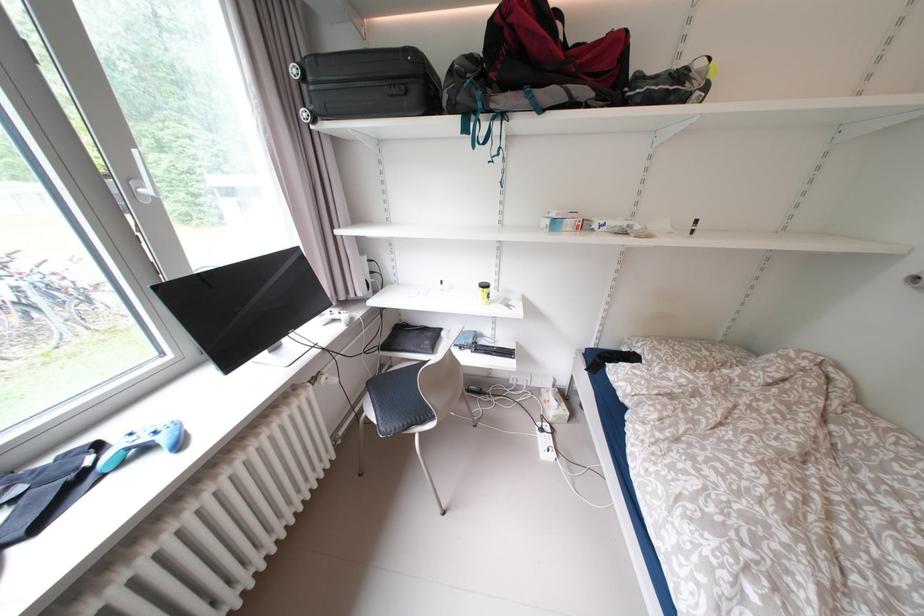
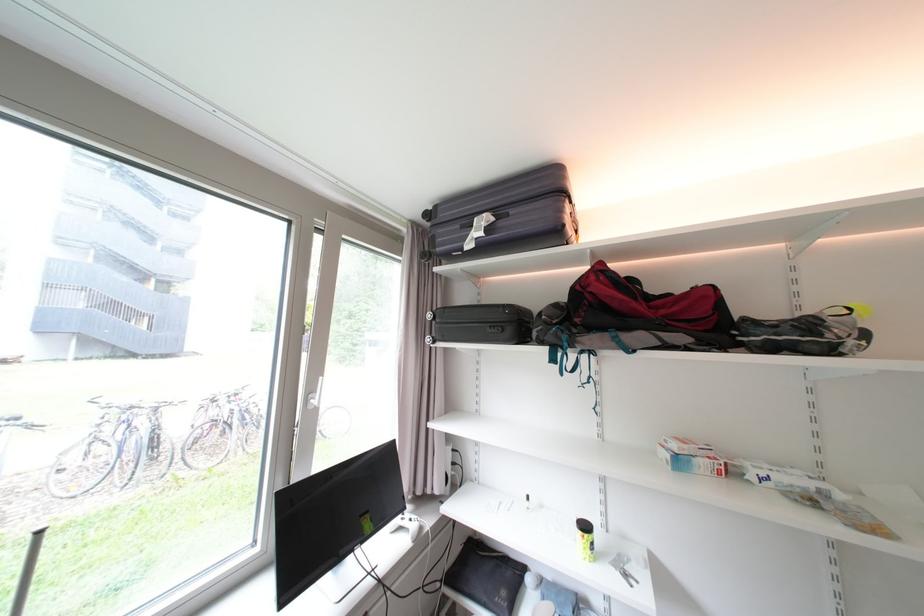
The point at (509,304) is marked in the first image. Where is the corresponding point in the second image?

(623, 565)